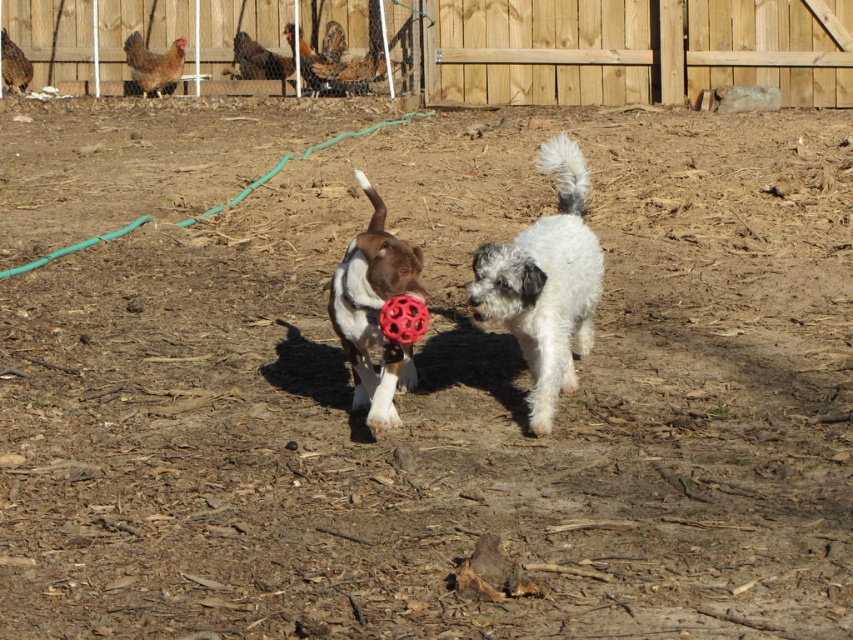
Looking at this image, you are a dog owner trying to fetch a ball for your dog. You see the wooden fence at upper center and the red rubber ball at center. Which object is wider?

The wooden fence at upper center is wider than the red rubber ball at center.

You are a dog trainer observing two dogs in a backyard. You notice the white fluffy dog at center and the brown and white fur at center. Which dog would you expect to have a larger shadow on the ground? Please explain your reasoning based on their sizes.

The white fluffy dog at center is larger in size than the brown and white fur at center. Generally, larger objects cast larger shadows, so the white fluffy dog at center would likely have a larger shadow on the ground.